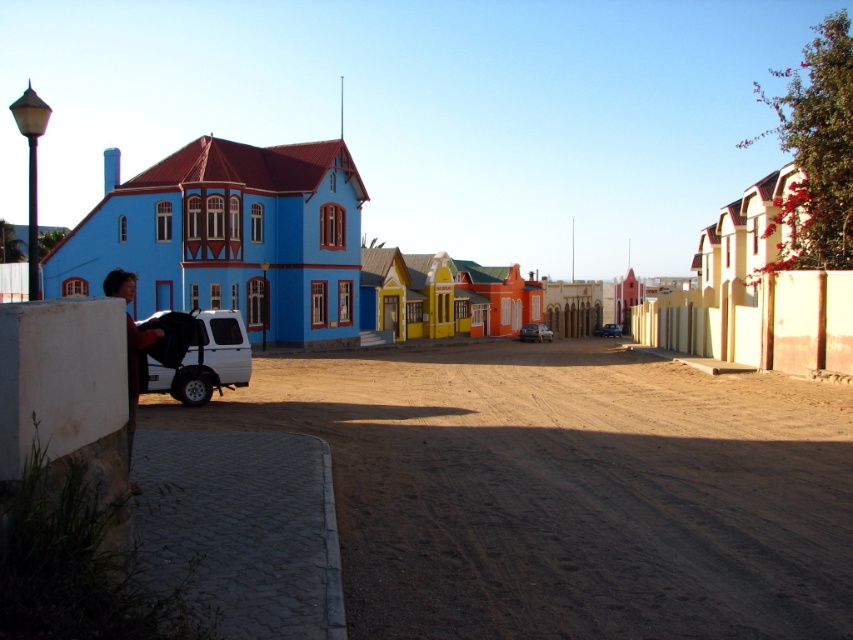
Question: Which point appears closest to the camera in this image?

Choices:
 (A) (601, 330)
 (B) (538, 323)

Answer: (B)

Question: Can you confirm if brown sandy dirt track at lower left is bigger than matte black car at center?

Choices:
 (A) yes
 (B) no

Answer: (A)

Question: Which object is farther from the camera taking this photo?

Choices:
 (A) metallic silver car at center
 (B) matte black car at center
 (C) black fabric baby carriage at lower left

Answer: (B)

Question: Observing the image, what is the correct spatial positioning of metallic silver car at center in reference to matte black car at center?

Choices:
 (A) left
 (B) right

Answer: (A)

Question: Which point is farther to the camera?

Choices:
 (A) matte black car at center
 (B) metallic silver car at center
 (C) black fabric baby carriage at lower left
 (D) brown sandy dirt track at lower left

Answer: (A)

Question: Is brown sandy dirt track at lower left to the left of matte black car at center from the viewer's perspective?

Choices:
 (A) yes
 (B) no

Answer: (A)